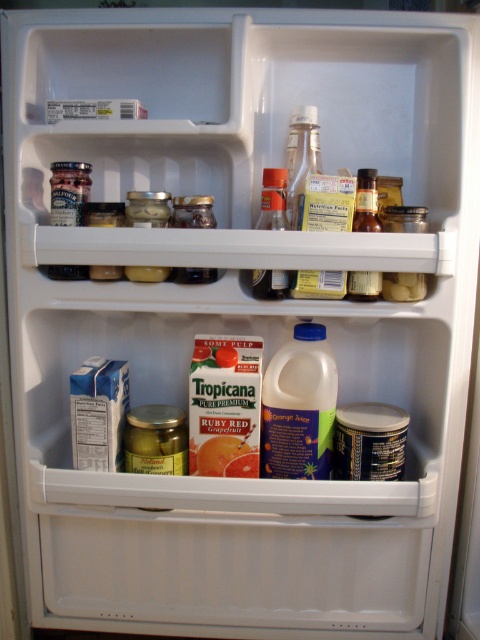
Question: Can you confirm if translucent plastic bottle at center is positioned below translucent glass bottle at upper center?

Choices:
 (A) yes
 (B) no

Answer: (A)

Question: Is matte glass jar at upper left thinner than translucent plastic bottle at center?

Choices:
 (A) yes
 (B) no

Answer: (B)

Question: Which is nearer to the translucent glass bottle at upper center?

Choices:
 (A) matte glass jar at upper left
 (B) translucent plastic bottle at center

Answer: (B)

Question: Does translucent plastic bottle at center have a smaller size compared to translucent glass bottle at upper center?

Choices:
 (A) yes
 (B) no

Answer: (B)

Question: Based on their relative distances, which object is farther from the translucent glass bottle at upper center?

Choices:
 (A) translucent plastic bottle at center
 (B) matte glass jar at upper left

Answer: (B)

Question: Based on their relative distances, which object is nearer to the matte glass jar at upper left?

Choices:
 (A) translucent glass bottle at upper center
 (B) translucent plastic bottle at center

Answer: (B)